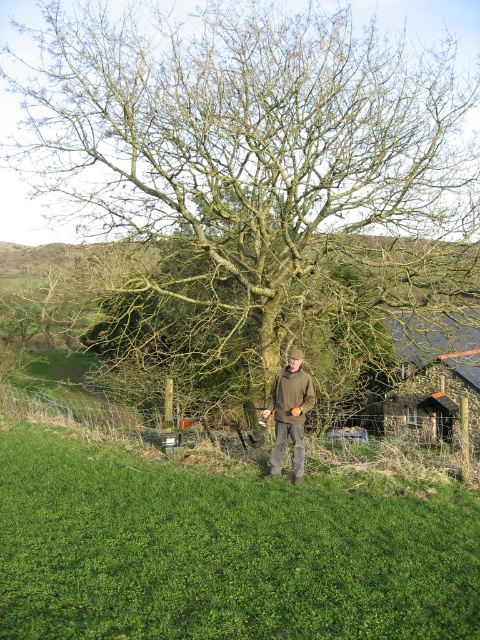
Question: Does green grassy at center have a lesser width compared to stone slate roof hut at right?

Choices:
 (A) yes
 (B) no

Answer: (A)

Question: Which point appears farthest from the camera in this image?

Choices:
 (A) (434, 412)
 (B) (402, 620)
 (C) (361, 118)

Answer: (A)

Question: Is stone slate roof hut at right above brown woolen jacket at center?

Choices:
 (A) yes
 (B) no

Answer: (B)

Question: Which point is farther to the camera?

Choices:
 (A) green grassy at center
 (B) brown woolen jacket at center

Answer: (B)

Question: Does green grassy at center appear on the right side of stone slate roof hut at right?

Choices:
 (A) no
 (B) yes

Answer: (A)

Question: Which of the following is the closest to the observer?

Choices:
 (A) stone slate roof hut at right
 (B) green grassy at center
 (C) green rough bark tree at center
 (D) brown woolen jacket at center

Answer: (B)